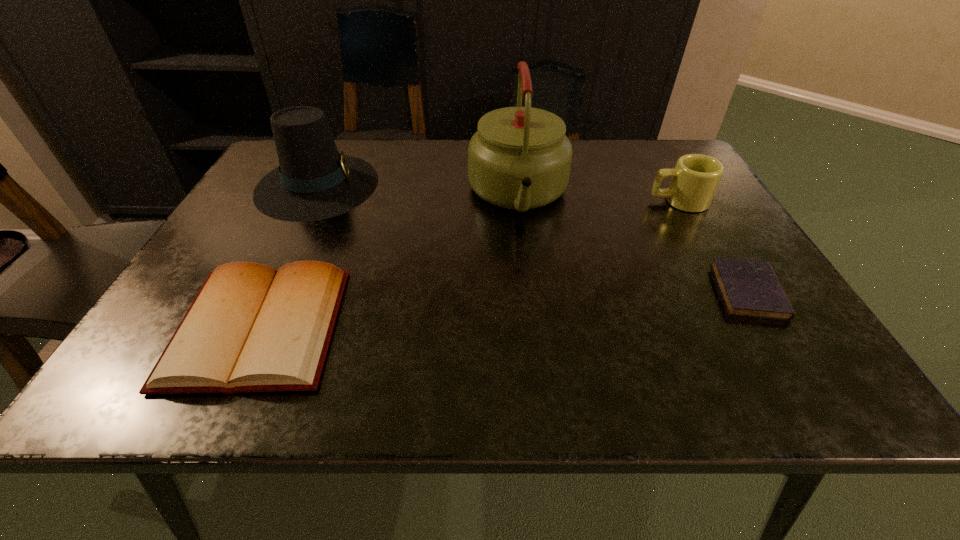
Where is `object positioned at the far left corner`? The image size is (960, 540). object positioned at the far left corner is located at coordinates (314, 181).

The height and width of the screenshot is (540, 960). Find the location of `object that is positioned at the near left corner`. object that is positioned at the near left corner is located at coordinates click(x=251, y=328).

Identify the location of blank space at the far edge. (394, 143).

Where is `free space at the near edge`? The image size is (960, 540). free space at the near edge is located at coordinates (361, 358).

Locate an element on the screen. blank space at the left edge of the desktop is located at coordinates (298, 222).

The height and width of the screenshot is (540, 960). What are the coordinates of `vacant space at the far left corner of the desktop` in the screenshot? It's located at (259, 178).

Image resolution: width=960 pixels, height=540 pixels. In the image, there is a desktop. What are the coordinates of `vacant space at the near left corner` in the screenshot? It's located at (156, 361).

Where is `vacant space at the far right corner of the desktop`? vacant space at the far right corner of the desktop is located at coordinates (644, 146).

Find the location of a particular element. This screenshot has height=540, width=960. vacant area between the fourth tallest object and the third shortest object is located at coordinates (468, 264).

Where is `free space that is in between the diary and the hat`? free space that is in between the diary and the hat is located at coordinates (533, 238).